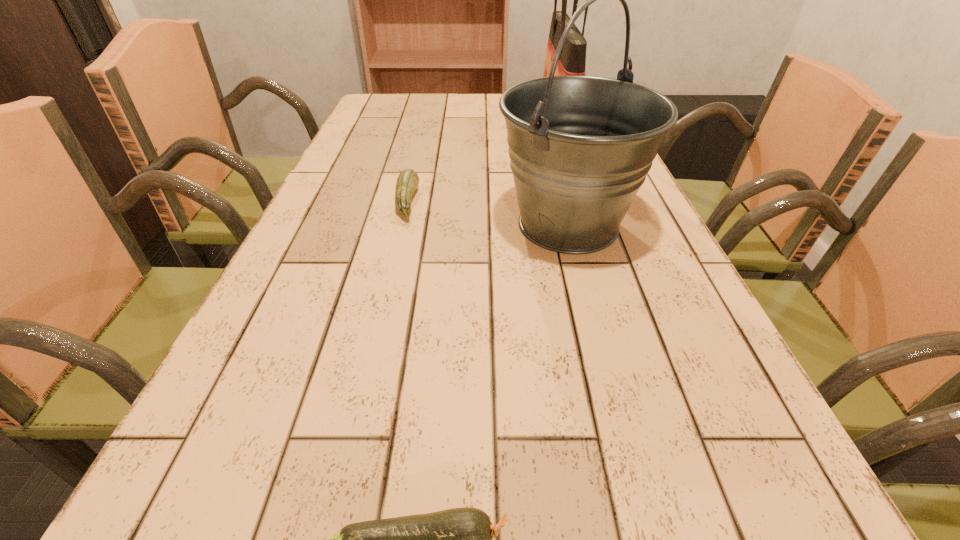
Locate an element on the screen. This screenshot has height=540, width=960. shopping bag is located at coordinates (572, 61).

Find the location of a particular element. Image resolution: width=960 pixels, height=540 pixels. the farthest object is located at coordinates (572, 61).

Find the location of `the second tallest object`. the second tallest object is located at coordinates (580, 147).

Locate an element on the screen. The image size is (960, 540). the farther zucchini is located at coordinates (408, 180).

At what (x,y) coordinates should I click in order to perform the action: click on blank space located 0.320m on the front-facing side of the shopping bag. Please return your answer as a coordinate pair (x, y). The width and height of the screenshot is (960, 540). Looking at the image, I should click on (435, 125).

Find the location of a particular element. The image size is (960, 540). vacant area situated on the front-facing side of the shopping bag is located at coordinates (444, 125).

Identify the location of free location located on the front-facing side of the shopping bag. The height and width of the screenshot is (540, 960). (454, 125).

Identify the location of free location located on the left of the bucket. The image size is (960, 540). (411, 225).

The height and width of the screenshot is (540, 960). What are the coordinates of `blank space located 0.060m at the stem end of the farther zucchini` in the screenshot? It's located at (444, 202).

The image size is (960, 540). What are the coordinates of `object at the far edge` in the screenshot? It's located at (572, 61).